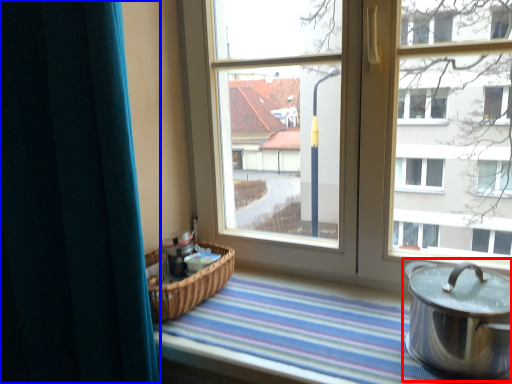
Question: Which object is further to the camera taking this photo, crock pot (highlighted by a red box) or curtain (highlighted by a blue box)?

Choices:
 (A) crock pot
 (B) curtain

Answer: (A)